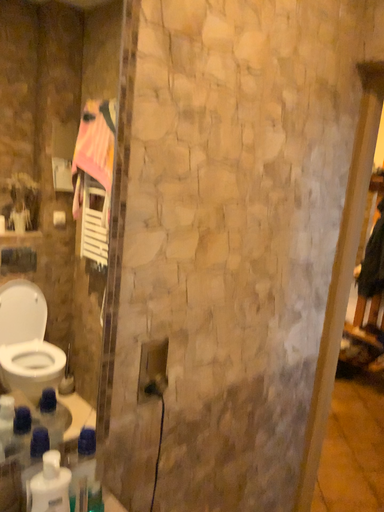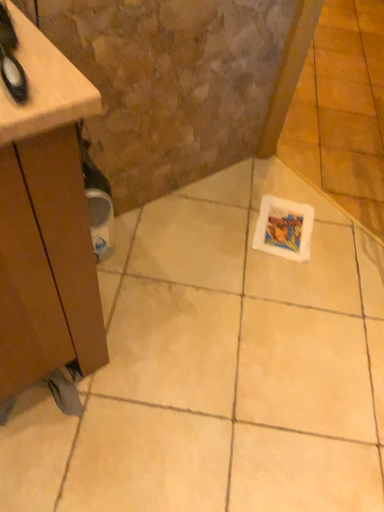
Question: How did the camera likely rotate when shooting the video?

Choices:
 (A) rotated downward
 (B) rotated upward

Answer: (A)